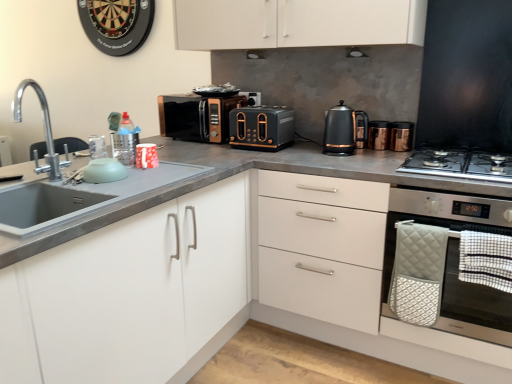
The height and width of the screenshot is (384, 512). Find the location of `vacant space that's between stainless steel gas stove at right and metallic copper kettle at upper right, which appears as the 2th appliance when viewed from the top`. vacant space that's between stainless steel gas stove at right and metallic copper kettle at upper right, which appears as the 2th appliance when viewed from the top is located at coordinates (392, 152).